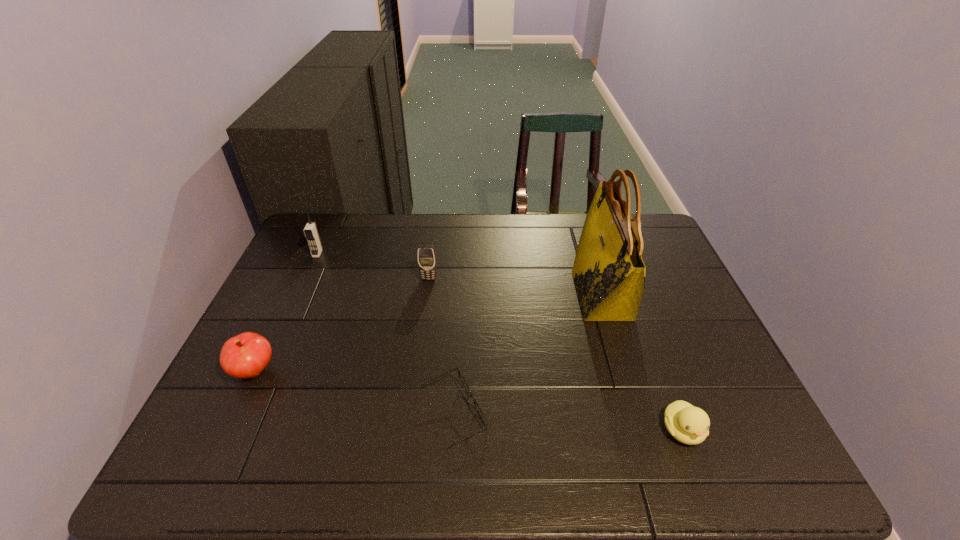
Where is `free space at the near left corner`? Image resolution: width=960 pixels, height=540 pixels. free space at the near left corner is located at coordinates (204, 450).

Where is `free point between the duckling and the spectacles`? The width and height of the screenshot is (960, 540). free point between the duckling and the spectacles is located at coordinates (568, 422).

Locate an element on the screen. The image size is (960, 540). vacant region between the shortest object and the nearer cellular telephone is located at coordinates (442, 347).

Where is `vacant area between the left cellular telephone and the fifth tallest object`? The height and width of the screenshot is (540, 960). vacant area between the left cellular telephone and the fifth tallest object is located at coordinates (500, 342).

This screenshot has height=540, width=960. Find the location of `unoccupied area between the apple and the nearer cellular telephone`. unoccupied area between the apple and the nearer cellular telephone is located at coordinates 342,325.

At what (x,y) coordinates should I click in order to perform the action: click on empty space that is in between the tote bag and the second shortest object. Please return your answer as a coordinate pair (x, y). The image size is (960, 540). Looking at the image, I should click on (642, 363).

What are the coordinates of `blank region between the tote bag and the apple` in the screenshot? It's located at (428, 333).

Identify the location of blank region between the shorter cellular telephone and the fifth tallest object. The height and width of the screenshot is (540, 960). (556, 355).

Identify the location of empty space between the shortest object and the second shortest object. This screenshot has width=960, height=540. (568, 422).

Where is `free space between the nearer cellular telephone and the second shortest object`? free space between the nearer cellular telephone and the second shortest object is located at coordinates (556, 355).